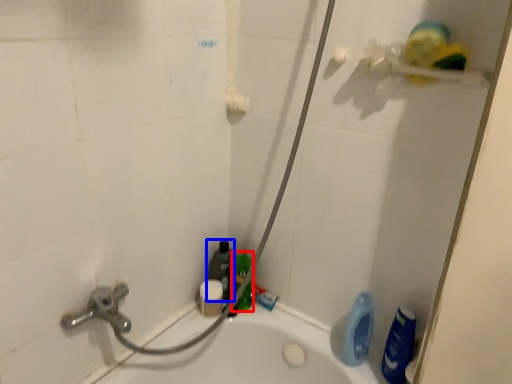
Question: Which of the following is the closest to the observer, cleaning product (highlighted by a red box) or cleaning product (highlighted by a blue box)?

Choices:
 (A) cleaning product
 (B) cleaning product

Answer: (A)